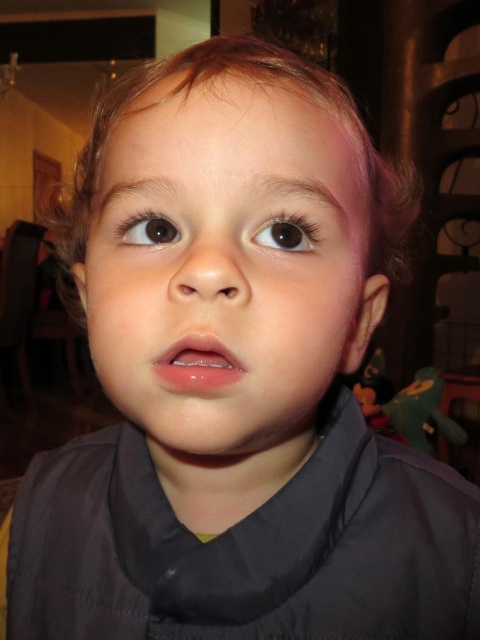
Looking at the child in the image, which object is taller between the smooth skin face at center and the brown glossy eye at upper left?

The smooth skin face at center is much taller than the brown glossy eye at upper left.

You are a photographer adjusting the lighting for a portrait. You need to ensure that the smooth skin face at center and the brown glossy eye at upper left are both well illuminated. Based on their positions, which object should you adjust the light towards first?

The brown glossy eye at upper left should be adjusted first because the smooth skin face at center is positioned to its right, meaning the eye is closer to the left side where the light might not be reaching adequately. Adjusting the light towards the eye first ensures both areas receive balanced illumination.

What are the coordinates of the smooth skin face at center?

The smooth skin face at center is located at coordinates point (225,266).